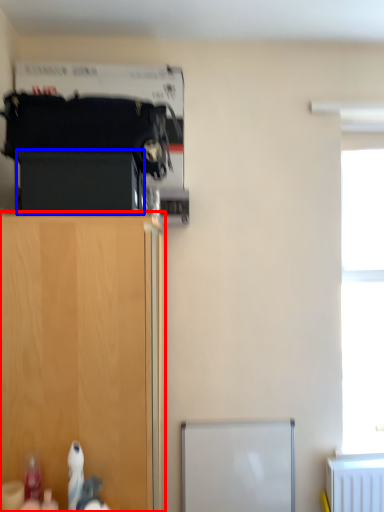
Question: Which of the following is the closest to the observer, cupboard (highlighted by a red box) or cabinetry (highlighted by a blue box)?

Choices:
 (A) cupboard
 (B) cabinetry

Answer: (A)